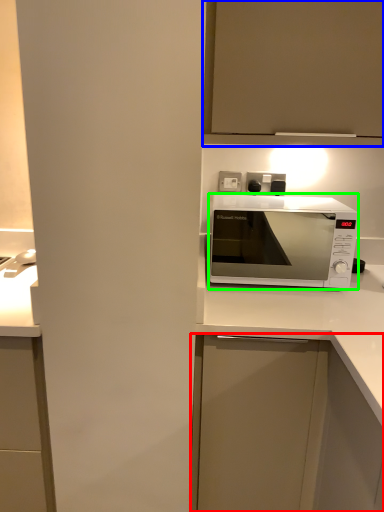
Question: Which is nearer to the cabinetry (highlighted by a red box)? cabinetry (highlighted by a blue box) or microwave oven (highlighted by a green box).

Choices:
 (A) cabinetry
 (B) microwave oven

Answer: (A)